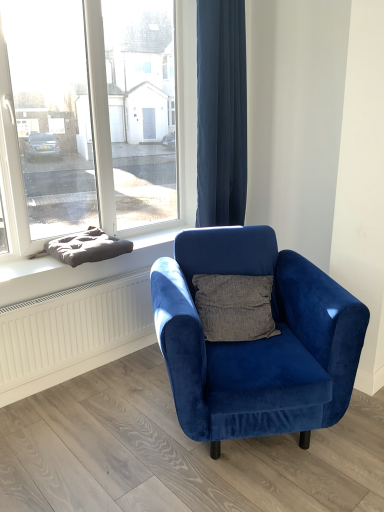
At what (x,y) coordinates should I click in order to perform the action: click on vacant space situated on the left part of velvet blue armchair at center. Please return your answer as a coordinate pair (x, y). The image size is (384, 512). Looking at the image, I should click on (94, 419).